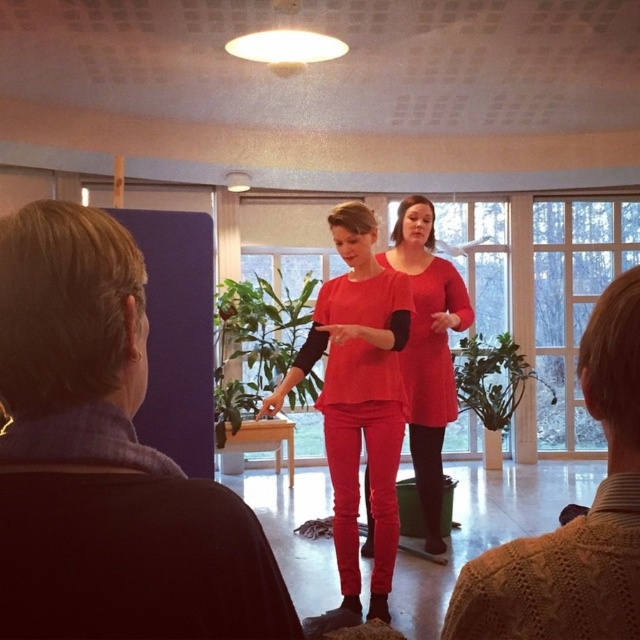
Question: Is dark blue wool sweater at left closer to camera compared to matte red pants at center?

Choices:
 (A) yes
 (B) no

Answer: (A)

Question: Which point is farther to the camera?

Choices:
 (A) matte red pants at center
 (B) dark blue wool sweater at left
 (C) knitted sweater at lower right

Answer: (A)

Question: Among these points, which one is farthest from the camera?

Choices:
 (A) (339, 433)
 (B) (589, 317)
 (C) (432, 481)
 (D) (140, 584)

Answer: (C)

Question: Estimate the real-world distances between objects in this image. Which object is closer to the matte red dress at center?

Choices:
 (A) knitted sweater at lower right
 (B) matte red pants at center

Answer: (B)

Question: Does dark blue wool sweater at left appear under knitted sweater at lower right?

Choices:
 (A) yes
 (B) no

Answer: (B)

Question: Does matte red pants at center appear over matte red dress at center?

Choices:
 (A) no
 (B) yes

Answer: (A)